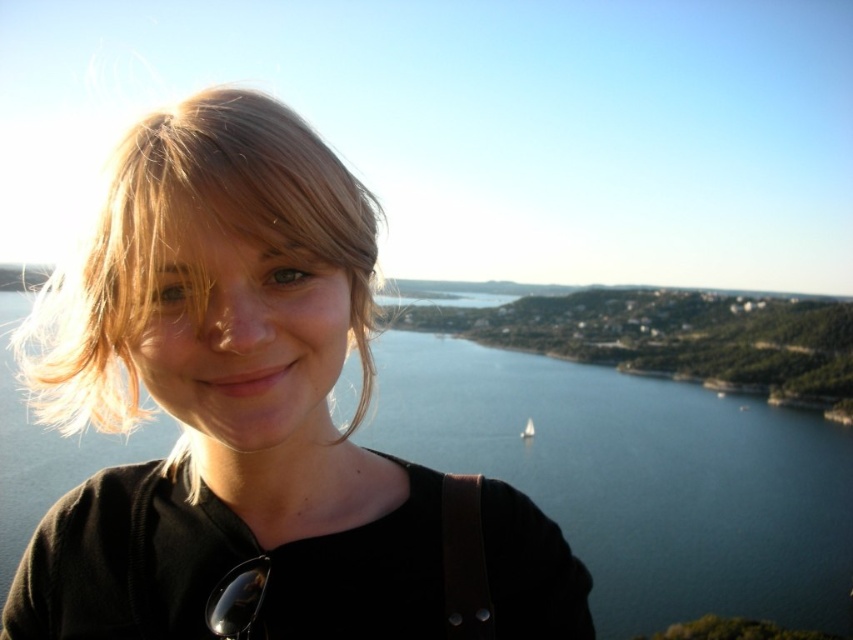
Looking at this image, does matte black hair at upper left have a lesser width compared to blonde hair at left?

Yes.

Which of these two, matte black hair at upper left or blonde hair at left, stands shorter?

With less height is blonde hair at left.

This screenshot has width=853, height=640. Identify the location of matte black hair at upper left. (x=253, y=419).

This screenshot has height=640, width=853. What are the coordinates of `matte black hair at upper left` in the screenshot? It's located at (253, 419).

Does matte black hair at upper left lie behind white sailboat at center?

That is False.

Looking at this image, who is more distant from viewer, (314, 438) or (532, 428)?

Positioned behind is point (532, 428).

Where is `matte black hair at upper left`? matte black hair at upper left is located at coordinates (253, 419).

Is blonde hair at left to the left of white sailboat at center from the viewer's perspective?

Yes, blonde hair at left is to the left of white sailboat at center.

Which of these two, blonde hair at left or white sailboat at center, stands shorter?

white sailboat at center is shorter.

Is point (148, 116) farther from camera compared to point (527, 436)?

No, it is not.

The width and height of the screenshot is (853, 640). I want to click on blonde hair at left, so click(x=170, y=236).